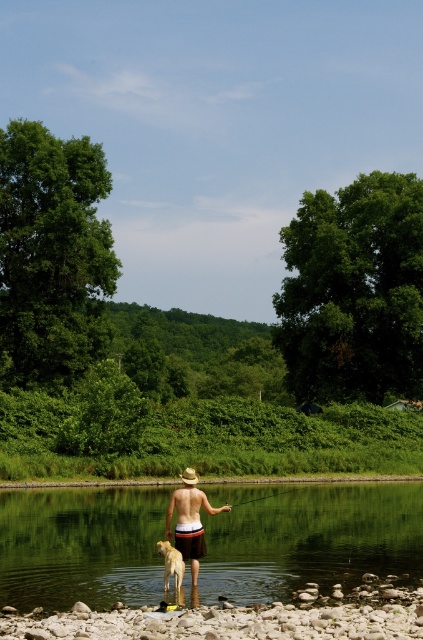
Question: Can you confirm if tan straw hat at center is thinner than golden fur dog at lower center?

Choices:
 (A) no
 (B) yes

Answer: (A)

Question: Among these objects, which one is farthest from the camera?

Choices:
 (A) tan straw hat at center
 (B) clear water at center
 (C) golden fur dog at lower center
 (D) smooth sand shore at lower center

Answer: (D)

Question: Can you confirm if clear water at center is wider than tan straw hat at center?

Choices:
 (A) no
 (B) yes

Answer: (B)

Question: Which object appears farthest from the camera in this image?

Choices:
 (A) tan straw hat at center
 (B) golden fur dog at lower center
 (C) clear water at center
 (D) smooth sand shore at lower center

Answer: (D)

Question: Which object appears farthest from the camera in this image?

Choices:
 (A) golden fur dog at lower center
 (B) tan straw hat at center
 (C) clear water at center

Answer: (B)

Question: Is clear water at center to the left of golden fur dog at lower center from the viewer's perspective?

Choices:
 (A) yes
 (B) no

Answer: (B)